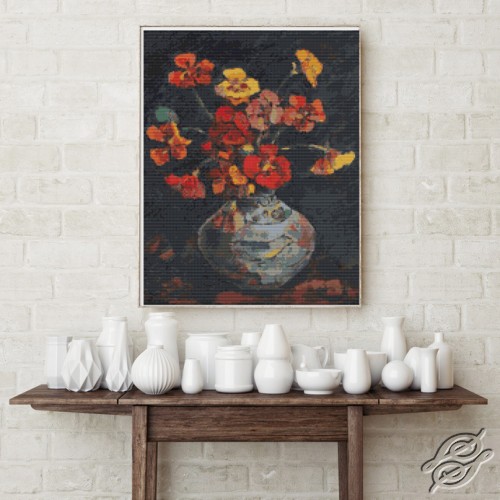
The height and width of the screenshot is (500, 500). Identify the location of vase. (293, 244).